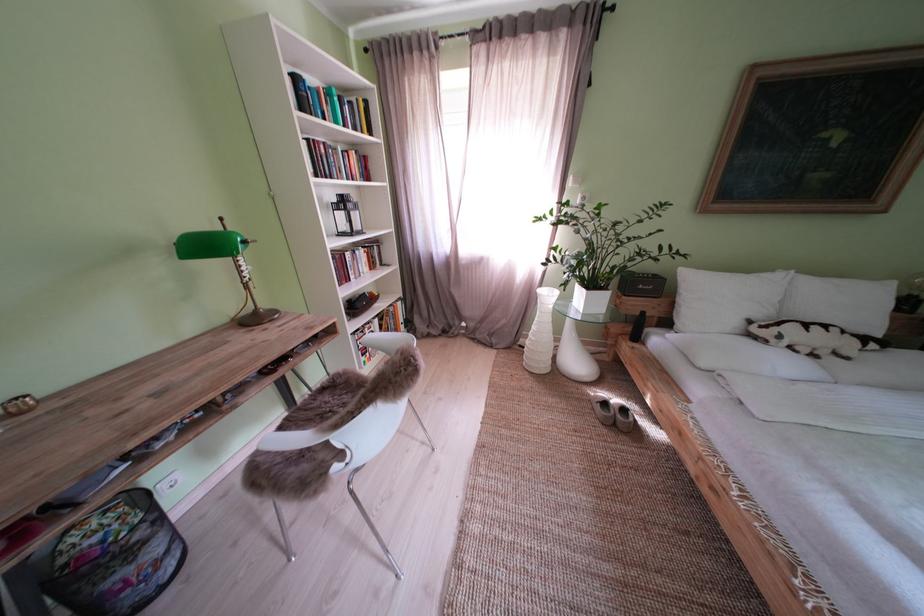
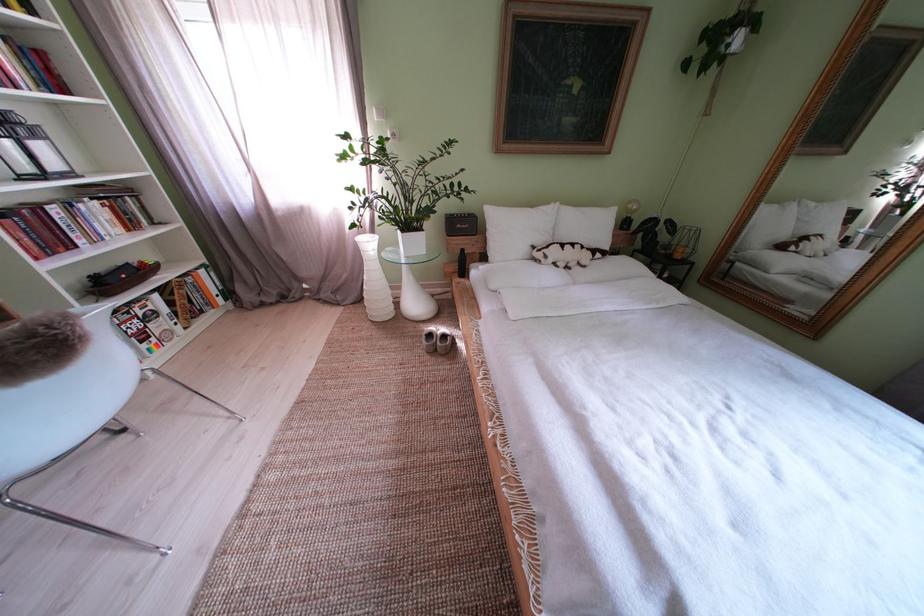
Question: The images are taken continuously from a first-person perspective. In which direction is your viewpoint rotating?

Choices:
 (A) Left
 (B) Right
 (C) Up
 (D) Down

Answer: (B)